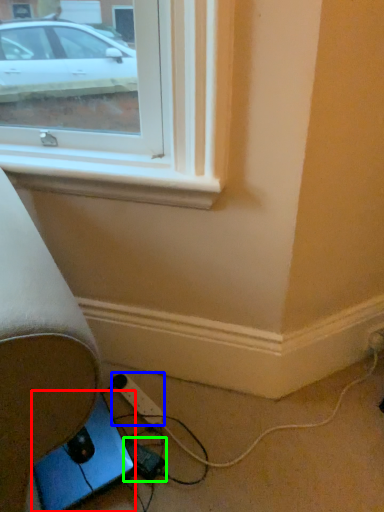
Question: Which object is the closest to the gadget (highlighted by a red box)? Choose among these: extension cord (highlighted by a blue box) or extension cord (highlighted by a green box).

Choices:
 (A) extension cord
 (B) extension cord

Answer: (B)